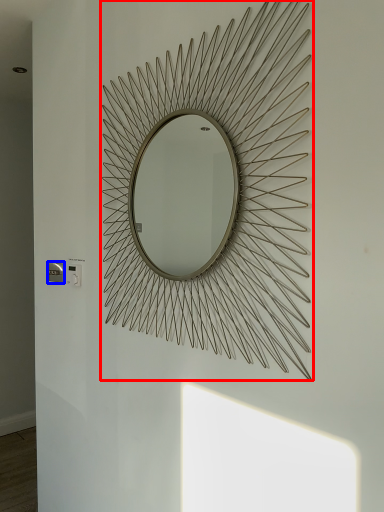
Question: Among these objects, which one is nearest to the camera, mirror (highlighted by a red box) or electric outlet (highlighted by a blue box)?

Choices:
 (A) mirror
 (B) electric outlet

Answer: (A)